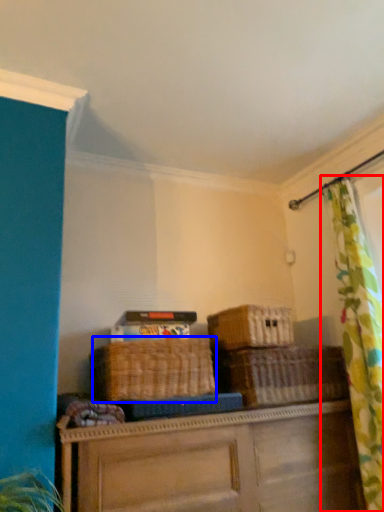
Question: Which object is further to the camera taking this photo, curtain (highlighted by a red box) or basket (highlighted by a blue box)?

Choices:
 (A) curtain
 (B) basket

Answer: (B)